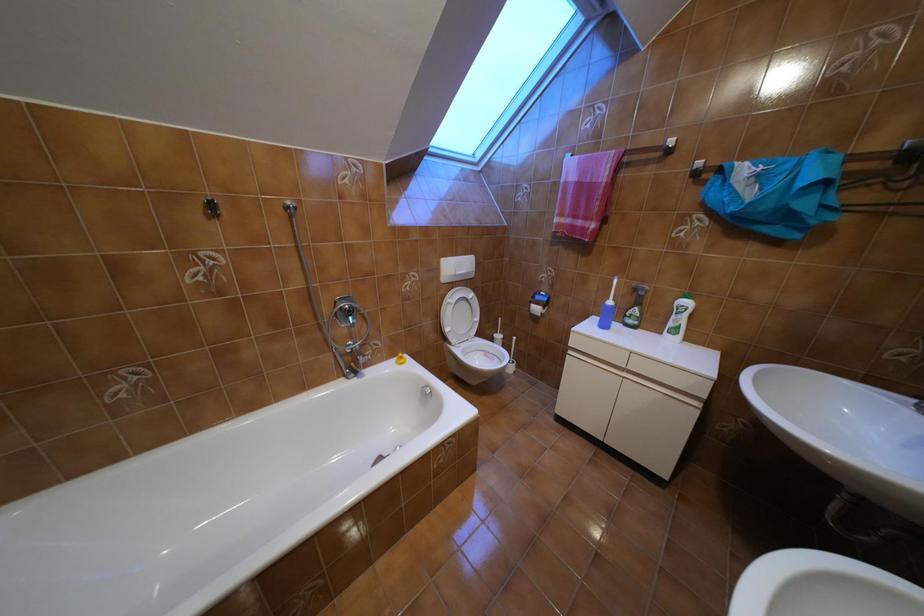
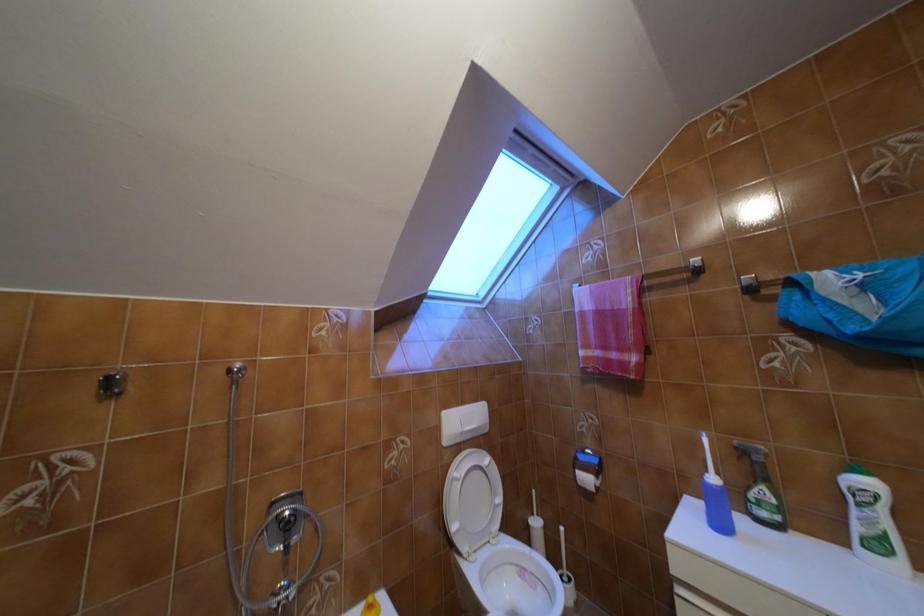
Question: The images are taken continuously from a first-person perspective. In which direction is your viewpoint rotating?

Choices:
 (A) Left
 (B) Right
 (C) Up
 (D) Down

Answer: (C)